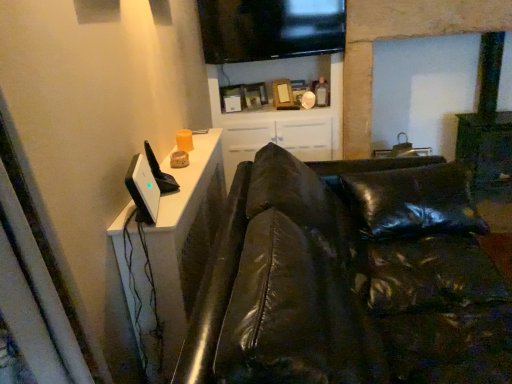
Question: Considering the relative positions of black leather couch at left and white glossy dresser at upper left in the image provided, is black leather couch at left behind white glossy dresser at upper left?

Choices:
 (A) no
 (B) yes

Answer: (A)

Question: From the image's perspective, is black leather couch at left under white glossy dresser at upper left?

Choices:
 (A) yes
 (B) no

Answer: (A)

Question: Considering the relative sizes of black leather couch at left and white glossy dresser at upper left in the image provided, is black leather couch at left thinner than white glossy dresser at upper left?

Choices:
 (A) yes
 (B) no

Answer: (B)

Question: Considering the relative sizes of black leather couch at left and white glossy dresser at upper left in the image provided, is black leather couch at left taller than white glossy dresser at upper left?

Choices:
 (A) no
 (B) yes

Answer: (B)

Question: Is black leather couch at left in front of white glossy dresser at upper left?

Choices:
 (A) yes
 (B) no

Answer: (A)

Question: Based on their positions, is black leather couch at left located to the left or right of white glossy cabinet at upper center?

Choices:
 (A) left
 (B) right

Answer: (B)

Question: In the image, is black leather couch at left positioned in front of or behind white glossy cabinet at upper center?

Choices:
 (A) front
 (B) behind

Answer: (A)

Question: Based on their sizes in the image, would you say black leather couch at left is bigger or smaller than white glossy cabinet at upper center?

Choices:
 (A) big
 (B) small

Answer: (A)

Question: Do you think black leather couch at left is within white glossy cabinet at upper center, or outside of it?

Choices:
 (A) inside
 (B) outside

Answer: (B)

Question: From their relative heights in the image, would you say flat screen tv at upper center is taller or shorter than white glossy cabinet at upper center?

Choices:
 (A) tall
 (B) short

Answer: (B)

Question: In terms of width, does flat screen tv at upper center look wider or thinner when compared to white glossy cabinet at upper center?

Choices:
 (A) wide
 (B) thin

Answer: (B)

Question: Would you say flat screen tv at upper center is inside or outside white glossy cabinet at upper center?

Choices:
 (A) inside
 (B) outside

Answer: (B)

Question: Does point (338, 14) appear closer or farther from the camera than point (248, 69)?

Choices:
 (A) closer
 (B) farther

Answer: (A)

Question: Based on their positions, is flat screen tv at upper center located to the left or right of white glossy dresser at upper left?

Choices:
 (A) left
 (B) right

Answer: (B)

Question: Considering their positions, is flat screen tv at upper center located in front of or behind white glossy dresser at upper left?

Choices:
 (A) behind
 (B) front

Answer: (A)